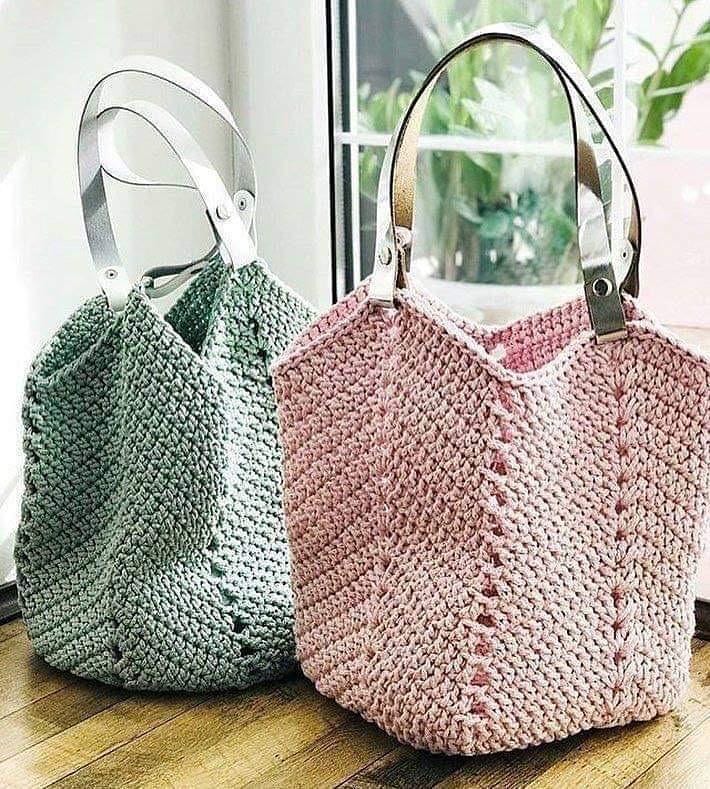
I want to click on handles, so click(404, 166), click(383, 208), click(185, 147), click(96, 215).